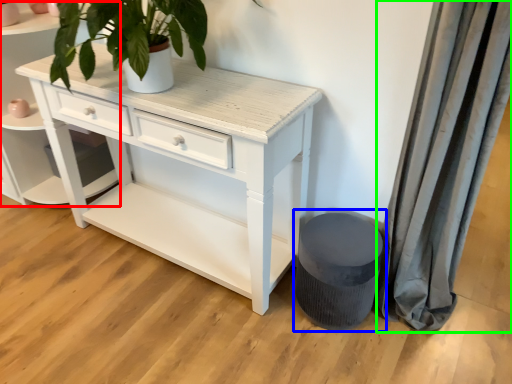
Question: Which is farther away from shelf (highlighted by a red box)? music stool (highlighted by a blue box) or curtain (highlighted by a green box)?

Choices:
 (A) music stool
 (B) curtain

Answer: (B)